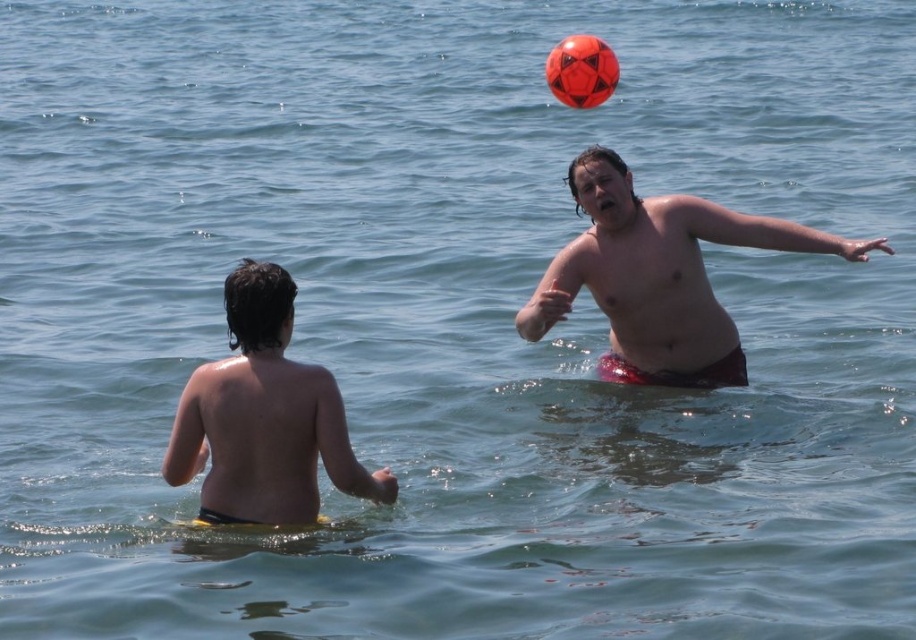
Is smooth skin child at center to the left of rubber ball at upper center from the viewer's perspective?

Correct, you'll find smooth skin child at center to the left of rubber ball at upper center.

Can you confirm if smooth skin child at center is positioned above rubber ball at upper center?

Incorrect, smooth skin child at center is not positioned above rubber ball at upper center.

Locate an element on the screen. Image resolution: width=916 pixels, height=640 pixels. smooth skin child at center is located at coordinates (264, 417).

You are a GUI agent. You are given a task and a screenshot of the screen. Output one action in this format:
    pyautogui.click(x=<x>, y=<y>)
    Task: Click on the smooth skin child at center
    The height and width of the screenshot is (640, 916).
    Given the screenshot: What is the action you would take?
    pyautogui.click(x=264, y=417)

Can you confirm if smooth red shorts at right is positioned above smooth skin child at center?

Yes, smooth red shorts at right is above smooth skin child at center.

Which of these two, smooth red shorts at right or smooth skin child at center, stands taller?

smooth skin child at center is taller.

Who is more distant from viewer, (660, 307) or (308, 518)?

The point (660, 307) is behind.

I want to click on smooth red shorts at right, so click(x=660, y=275).

Can you confirm if smooth red shorts at right is wider than rubber ball at upper center?

In fact, smooth red shorts at right might be narrower than rubber ball at upper center.

Does smooth red shorts at right appear on the left side of rubber ball at upper center?

No, smooth red shorts at right is not to the left of rubber ball at upper center.

Between point (587, 161) and point (570, 44), which one is positioned behind?

Point (570, 44)

You are a GUI agent. You are given a task and a screenshot of the screen. Output one action in this format:
    pyautogui.click(x=<x>, y=<y>)
    Task: Click on the smooth red shorts at right
    The height and width of the screenshot is (640, 916).
    Given the screenshot: What is the action you would take?
    pyautogui.click(x=660, y=275)